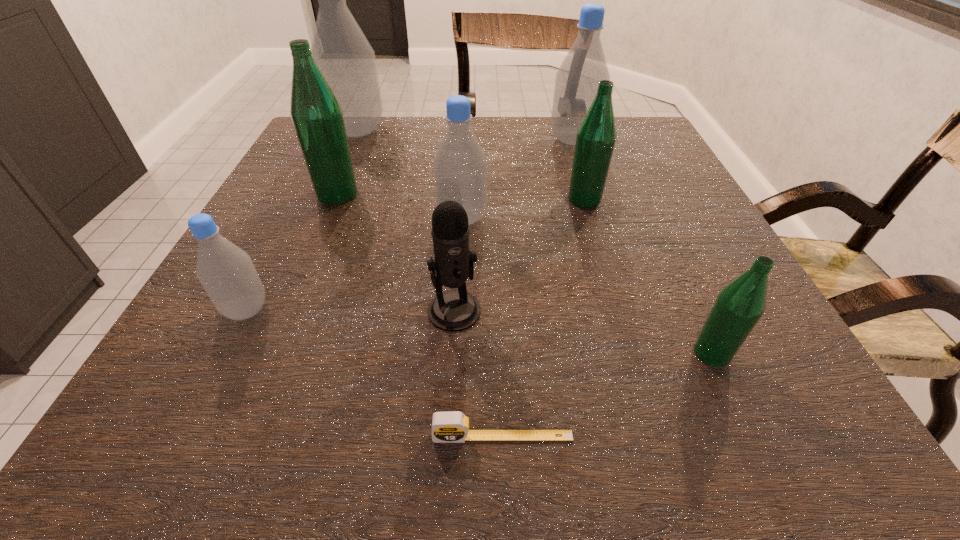
At what (x,y) coordinates should I click in order to perform the action: click on free spot that satisfies the following two spatial constraints: 1. on the front side of the rightmost bottle; 2. on the right side of the second biggest gray bottle. Please return your answer as a coordinate pair (x, y). The height and width of the screenshot is (540, 960). Looking at the image, I should click on (642, 353).